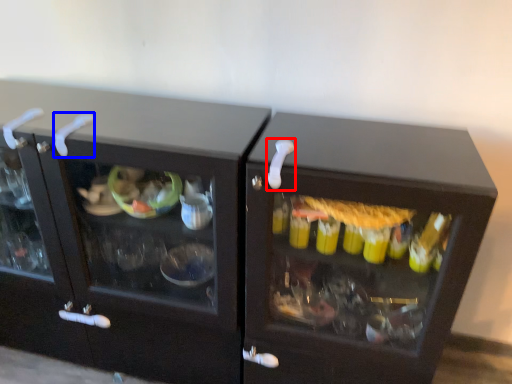
Question: Among these objects, which one is farthest to the camera, door handle (highlighted by a red box) or door handle (highlighted by a blue box)?

Choices:
 (A) door handle
 (B) door handle

Answer: (B)